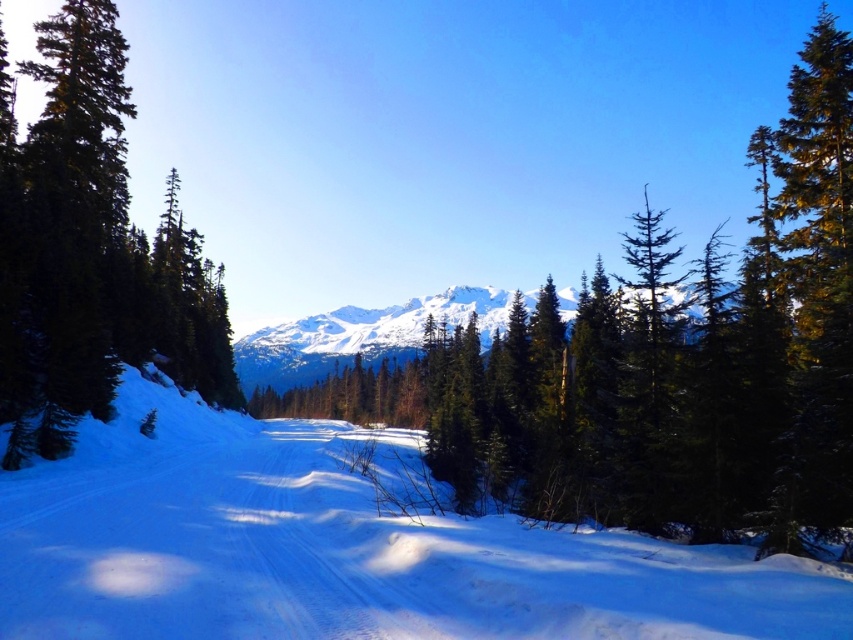
Question: Which point appears closest to the camera in this image?

Choices:
 (A) (68, 36)
 (B) (267, 467)

Answer: (B)

Question: Does white snow ski slope at center come behind white snow-covered mountain at center?

Choices:
 (A) no
 (B) yes

Answer: (A)

Question: Observing the image, what is the correct spatial positioning of white snow ski slope at center in reference to white snow-covered mountain at center?

Choices:
 (A) below
 (B) above

Answer: (A)

Question: Which object is closer to the camera taking this photo?

Choices:
 (A) white snow-covered mountain at center
 (B) green matte tree at left
 (C) white snow ski slope at center

Answer: (C)

Question: Is green matte tree at left closer to camera compared to white snow-covered mountain at center?

Choices:
 (A) no
 (B) yes

Answer: (B)

Question: Which is farther from the green matte tree at left?

Choices:
 (A) white snow ski slope at center
 (B) white snow-covered mountain at center

Answer: (B)